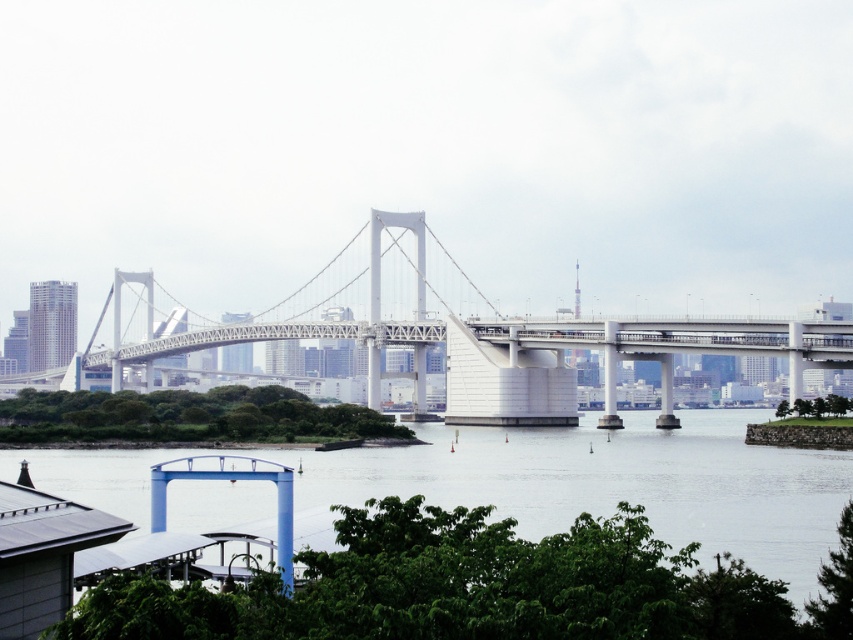
In the scene shown: You are standing at the blue structure in the lower left corner of the image and want to cross the white metallic suspension bridge at center. To reach the bridge, do you need to walk over or under the transparent water at lower center?

The transparent water at lower center is located below the white metallic suspension bridge at center, so to reach the bridge, you would need to walk over the transparent water at lower center.

Based on the photo, you are a photographer planning to capture the entire view of the white metallic suspension bridge at center and the transparent water at lower center in one shot. Based on the scene, which object will occupy more of the frame?

The white metallic suspension bridge at center occupies more space in the frame than the transparent water at lower center because the description states that the transparent water at lower center occupies less space than the white metallic suspension bridge at center.